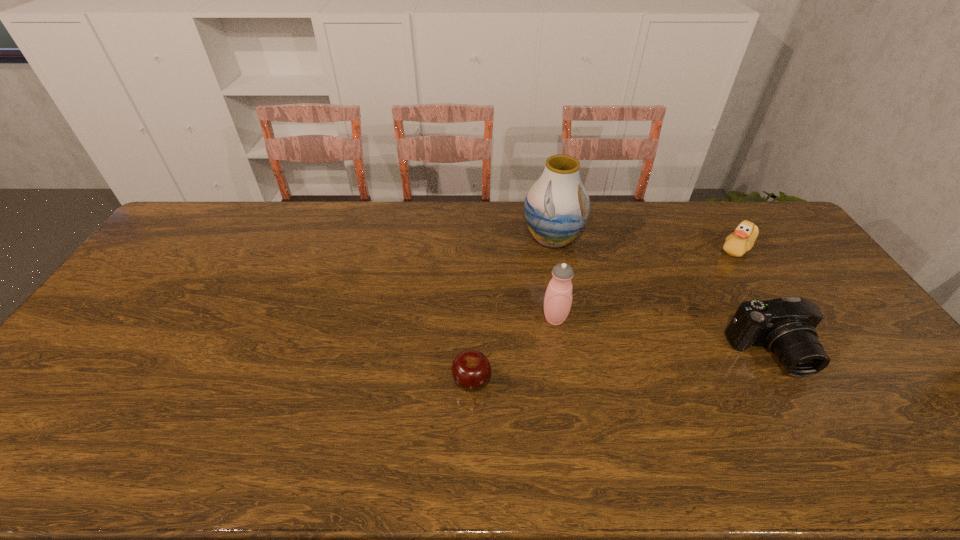
Choose which object is the nearest neighbor to the camera. Please provide its 2D coordinates. Your answer should be formatted as a tuple, i.e. [(x, y)], where the tuple contains the x and y coordinates of a point satisfying the conditions above.

[(736, 244)]

Locate an element on the screen. The height and width of the screenshot is (540, 960). vacant point that satisfies the following two spatial constraints: 1. on the back side of the tallest object; 2. on the left side of the shortest object is located at coordinates (474, 239).

Identify the location of free space that satisfies the following two spatial constraints: 1. at the beak of the duck; 2. on the front side of the apple. click(823, 381).

This screenshot has width=960, height=540. Find the location of `vacant region that satisfies the following two spatial constraints: 1. at the beak of the duck; 2. on the front side of the shortest object`. vacant region that satisfies the following two spatial constraints: 1. at the beak of the duck; 2. on the front side of the shortest object is located at coordinates (823, 381).